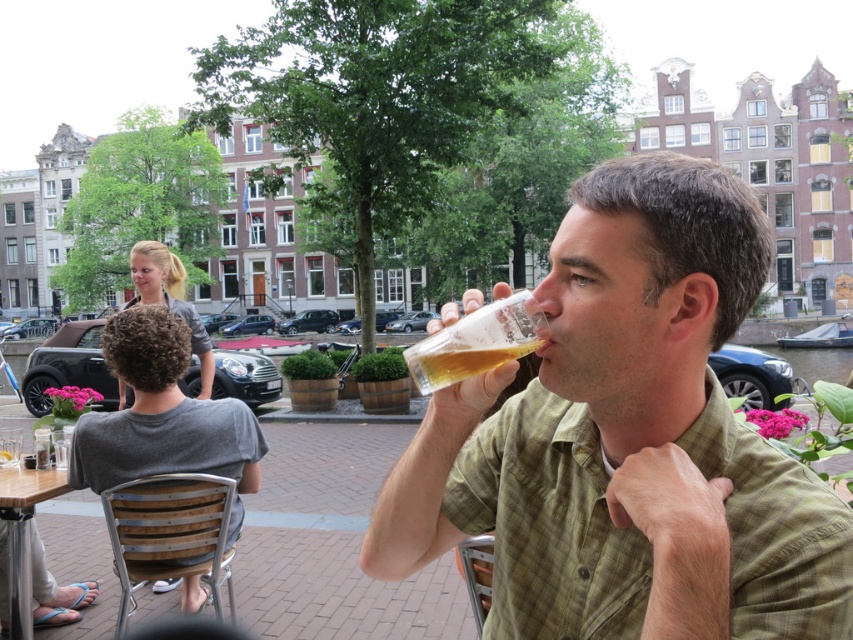
Question: Which point is closer to the camera?

Choices:
 (A) [135, 253]
 (B) [15, 538]
 (C) [148, 381]

Answer: (B)

Question: In this image, where is matte green shirt at center located relative to blonde hair at upper left?

Choices:
 (A) above
 (B) below

Answer: (B)

Question: Is matte green shirt at center smaller than wooden table at lower left?

Choices:
 (A) no
 (B) yes

Answer: (A)

Question: Which object is farther from the camera taking this photo?

Choices:
 (A) blonde hair at upper left
 (B) matte green shirt at center
 (C) translucent plastic glass at upper center
 (D) gray cotton shirt at upper left

Answer: (A)

Question: Considering the relative positions of gray cotton shirt at upper left and translucent plastic glass at upper center in the image provided, where is gray cotton shirt at upper left located with respect to translucent plastic glass at upper center?

Choices:
 (A) left
 (B) right

Answer: (A)

Question: Among these objects, which one is farthest from the camera?

Choices:
 (A) translucent glass at upper center
 (B) wooden table at lower left

Answer: (B)